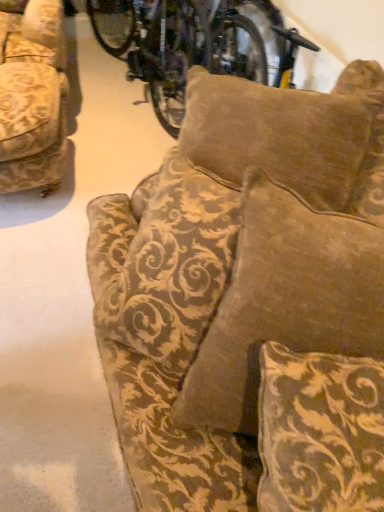
Question: Considering the relative positions of gold-patterned fabric couch at left, which is the first studio couch from back to front, and velvet gold-patterned couch at center, which is the first studio couch from bottom to top, in the image provided, is gold-patterned fabric couch at left, which is the first studio couch from back to front, in front of velvet gold-patterned couch at center, which is the first studio couch from bottom to top,?

Choices:
 (A) yes
 (B) no

Answer: (B)

Question: From a real-world perspective, does gold-patterned fabric couch at left, positioned as the 1th studio couch in left-to-right order, stand above velvet gold-patterned couch at center, marked as the 2th studio couch in a left-to-right arrangement?

Choices:
 (A) yes
 (B) no

Answer: (B)

Question: Considering the relative sizes of gold-patterned fabric couch at left, which is the second studio couch from bottom to top, and velvet gold-patterned couch at center, acting as the second studio couch starting from the top, in the image provided, is gold-patterned fabric couch at left, which is the second studio couch from bottom to top, thinner than velvet gold-patterned couch at center, acting as the second studio couch starting from the top,?

Choices:
 (A) yes
 (B) no

Answer: (A)

Question: From a real-world perspective, is gold-patterned fabric couch at left, marked as the second studio couch in a right-to-left arrangement, below velvet gold-patterned couch at center, the 2th studio couch viewed from the back?

Choices:
 (A) no
 (B) yes

Answer: (B)

Question: Is gold-patterned fabric couch at left, the 2th studio couch viewed from the front, placed right next to velvet gold-patterned couch at center, the 2th studio couch viewed from the back?

Choices:
 (A) yes
 (B) no

Answer: (B)

Question: Do you think brown velvety pillow at upper center, the 1th pillow positioned from the back, is within velvet gold-patterned couch at center, marked as the 2th studio couch in a left-to-right arrangement, or outside of it?

Choices:
 (A) outside
 (B) inside

Answer: (A)

Question: From their relative heights in the image, would you say brown velvety pillow at upper center, the 2th pillow from the front, is taller or shorter than velvet gold-patterned couch at center, the 2th studio couch viewed from the back?

Choices:
 (A) tall
 (B) short

Answer: (A)

Question: Visually, is brown velvety pillow at upper center, the 2th pillow from the front, positioned to the left or to the right of velvet gold-patterned couch at center, which is the first studio couch from bottom to top?

Choices:
 (A) right
 (B) left

Answer: (B)

Question: In terms of size, does brown velvety pillow at upper center, placed as the 2th pillow when sorted from bottom to top, appear bigger or smaller than velvet gold-patterned couch at center, which is the first studio couch from bottom to top?

Choices:
 (A) big
 (B) small

Answer: (A)

Question: Considering the positions of gold-patterned fabric couch at left, which is the first studio couch from back to front, and velvet gold-patterned pillow at center, the second pillow in the back-to-front sequence, in the image, is gold-patterned fabric couch at left, which is the first studio couch from back to front, wider or thinner than velvet gold-patterned pillow at center, the second pillow in the back-to-front sequence,?

Choices:
 (A) thin
 (B) wide

Answer: (B)

Question: From a real-world perspective, is gold-patterned fabric couch at left, which ranks as the 1th studio couch in top-to-bottom order, positioned above or below velvet gold-patterned pillow at center, the second pillow in the back-to-front sequence?

Choices:
 (A) above
 (B) below

Answer: (B)

Question: Considering the positions of gold-patterned fabric couch at left, which is the second studio couch from bottom to top, and velvet gold-patterned pillow at center, the 2th pillow when ordered from top to bottom, in the image, is gold-patterned fabric couch at left, which is the second studio couch from bottom to top, taller or shorter than velvet gold-patterned pillow at center, the 2th pillow when ordered from top to bottom,?

Choices:
 (A) short
 (B) tall

Answer: (A)

Question: Do you think gold-patterned fabric couch at left, which ranks as the 1th studio couch in top-to-bottom order, is within velvet gold-patterned pillow at center, the 1th pillow from the front, or outside of it?

Choices:
 (A) inside
 (B) outside

Answer: (B)

Question: Considering the positions of velvet gold-patterned couch at center, the 2th studio couch viewed from the back, and metallic silver bicycle at upper center in the image, is velvet gold-patterned couch at center, the 2th studio couch viewed from the back, taller or shorter than metallic silver bicycle at upper center?

Choices:
 (A) short
 (B) tall

Answer: (A)

Question: Based on their positions, is velvet gold-patterned couch at center, acting as the second studio couch starting from the top, located to the left or right of metallic silver bicycle at upper center?

Choices:
 (A) right
 (B) left

Answer: (A)